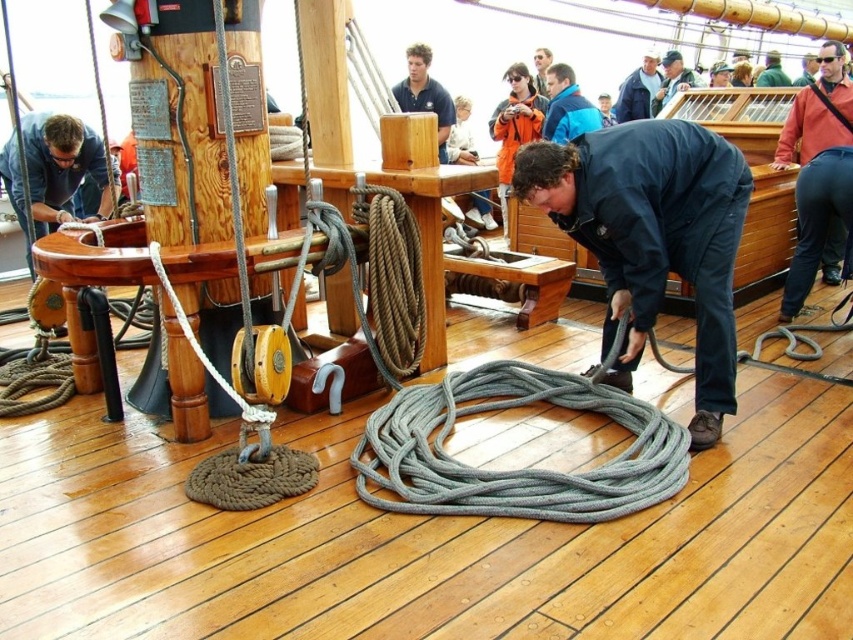
Question: Is dark blue fabric at center behind blue fabric jacket at upper center?

Choices:
 (A) no
 (B) yes

Answer: (A)

Question: Which object is closer to the camera taking this photo?

Choices:
 (A) dark blue fabric at center
 (B) blue fabric jacket at upper center

Answer: (A)

Question: Which point appears closest to the camera in this image?

Choices:
 (A) (714, 134)
 (B) (646, 113)

Answer: (A)

Question: Among these points, which one is farthest from the camera?

Choices:
 (A) [x=653, y=205]
 (B) [x=631, y=81]

Answer: (B)

Question: Does dark blue fabric at center have a lesser width compared to blue fabric jacket at upper center?

Choices:
 (A) no
 (B) yes

Answer: (A)

Question: Can you confirm if dark blue fabric at center is positioned below blue fabric jacket at upper center?

Choices:
 (A) yes
 (B) no

Answer: (A)